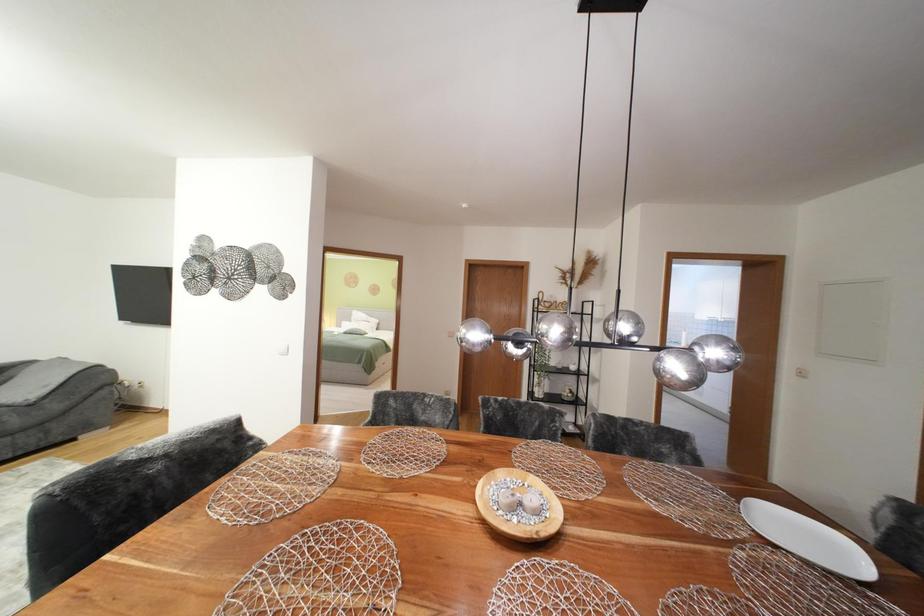
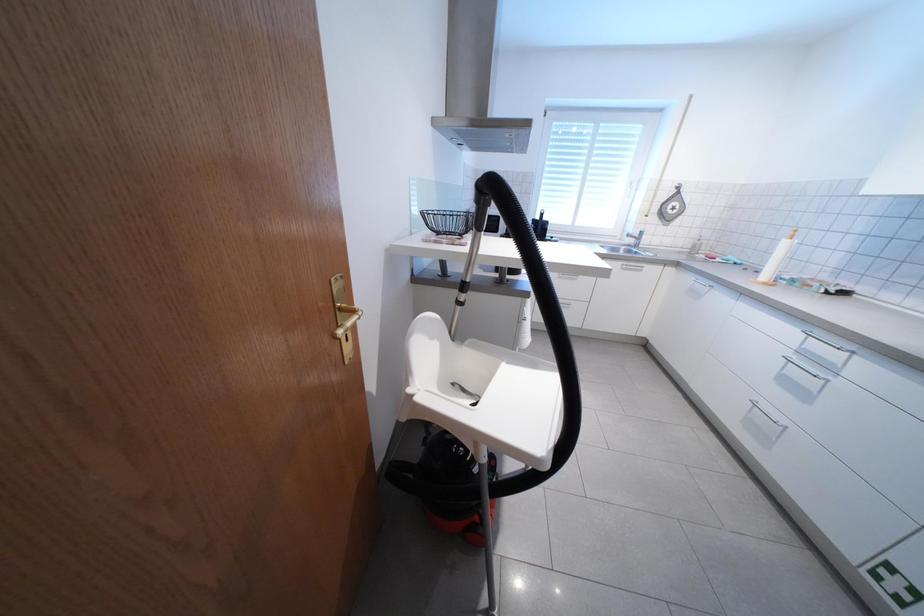
Based on the photo, in a continuous first-person perspective shot, in which direction is the camera moving?

The movement direction of the cameraman is right, forward.